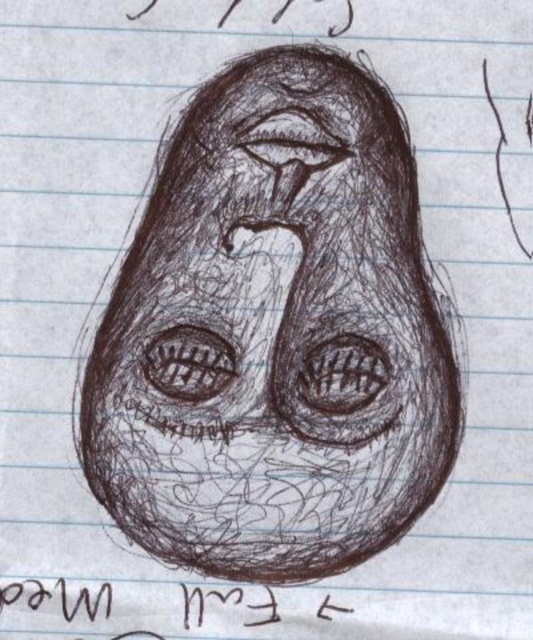
Looking at this image, you are an art student analyzing the drawing. The charcoal sketch face at center and the brown ink text at bottom are both on the same notebook page. Which object is wider?

The charcoal sketch face at center is wider than the brown ink text at bottom.

You are an art student analyzing a drawing. You notice the charcoal sketch face at center and the brown ink text at bottom. Based on their positions, which object is closer to the top edge of the paper?

The charcoal sketch face at center is located above the brown ink text at bottom, so it is closer to the top edge of the paper.

You are an art student who needs to frame a charcoal sketch face at center and brown ink text at bottom. The frame you have is 10 inches tall. Can the entire artwork fit vertically in the frame?

The charcoal sketch face at center is 7.44 inches away from brown ink text at bottom. Since the total height of the artwork would be the distance between them plus their individual sizes, but the frame is 10 inches tall, it might fit depending on the sizes of the face and text. However, without knowing their exact dimensions, we can only confirm that the distance between them is less than the frame height. Please check the total height including both elements.